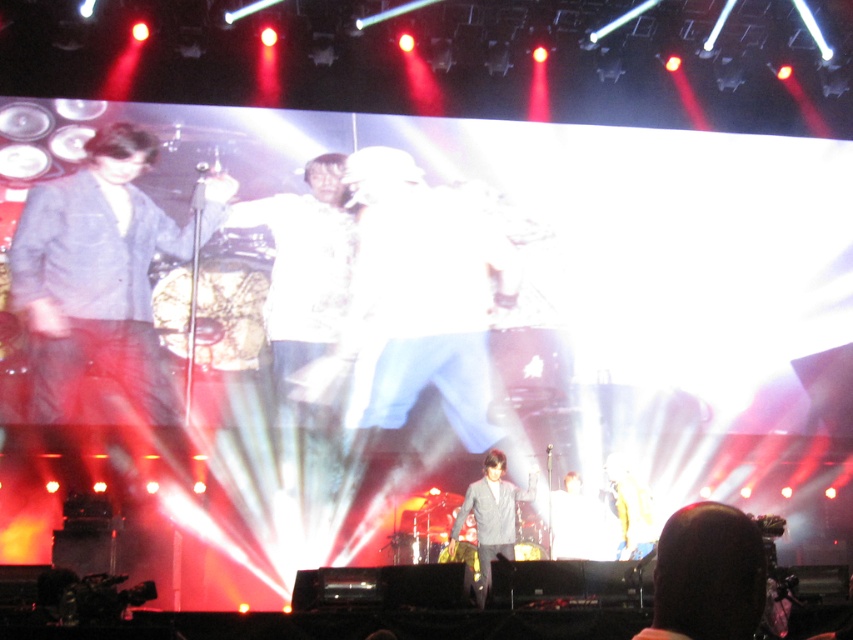
This screenshot has height=640, width=853. Identify the location of dark brown hair at lower right. (706, 576).

Is point (700, 532) farther from viewer compared to point (496, 536)?

No, (700, 532) is in front of (496, 536).

Based on the photo, who is more distant from viewer, (637, 632) or (492, 477)?

The point (492, 477) is more distant.

Identify the location of dark brown hair at lower right. The width and height of the screenshot is (853, 640). (706, 576).